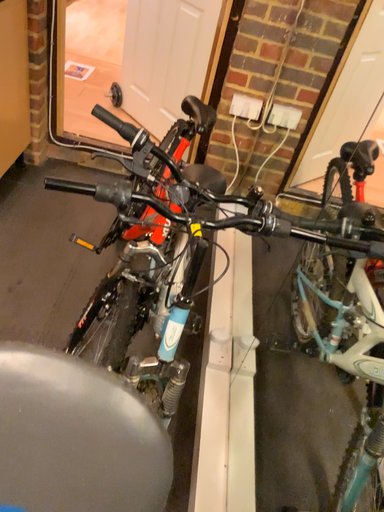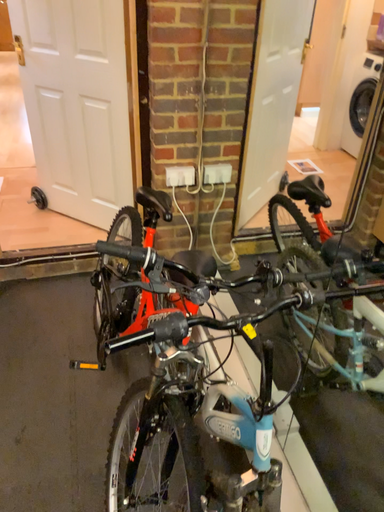
Question: How did the camera likely rotate when shooting the video?

Choices:
 (A) rotated right
 (B) rotated left

Answer: (A)